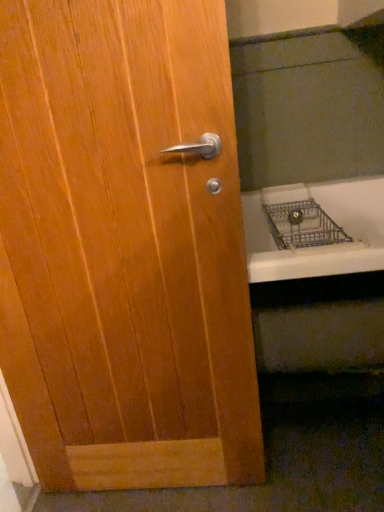
Question: In the image, is metallic silver bath at lower right positioned in front of or behind wooden door at center?

Choices:
 (A) front
 (B) behind

Answer: (B)

Question: Considering the relative positions of metallic silver bath at lower right and wooden door at center in the image provided, is metallic silver bath at lower right to the left or to the right of wooden door at center?

Choices:
 (A) left
 (B) right

Answer: (B)

Question: From the image's perspective, is metallic silver bath at lower right positioned above or below wooden door at center?

Choices:
 (A) above
 (B) below

Answer: (A)

Question: Do you think wooden door at center is within metallic silver bath at lower right, or outside of it?

Choices:
 (A) outside
 (B) inside

Answer: (A)

Question: From a real-world perspective, is wooden door at center positioned above or below metallic silver bath at lower right?

Choices:
 (A) below
 (B) above

Answer: (B)

Question: Considering their positions, is wooden door at center located in front of or behind metallic silver bath at lower right?

Choices:
 (A) front
 (B) behind

Answer: (A)

Question: From the image's perspective, is wooden door at center above or below metallic silver bath at lower right?

Choices:
 (A) below
 (B) above

Answer: (A)